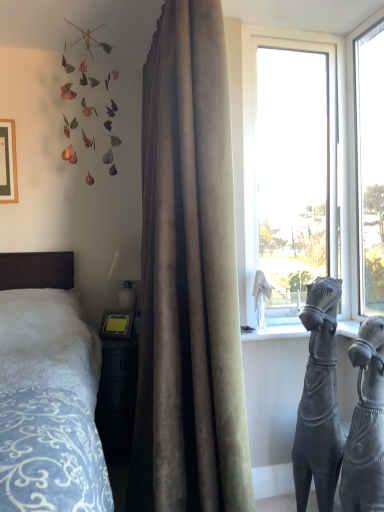
What do you see at coordinates (188, 278) in the screenshot? I see `satin curtain at center` at bounding box center [188, 278].

The height and width of the screenshot is (512, 384). In order to click on gray stone horse at right, which is the first sculpture in bottom-to-top order in this screenshot , I will do `click(366, 424)`.

Describe the element at coordinates (329, 144) in the screenshot. I see `transparent glass window at center, which appears as the 1th window when viewed from the left` at that location.

The width and height of the screenshot is (384, 512). In order to click on transparent glass sculpture at window, the 2th sculpture positioned from the front in this screenshot , I will do `click(261, 298)`.

Considering the sizes of objects transparent glass window at center, positioned as the second window in right-to-left order, and transparent glass window at upper right, the 2th window from the left, in the image provided, who is bigger, transparent glass window at center, positioned as the second window in right-to-left order, or transparent glass window at upper right, the 2th window from the left,?

Bigger between the two is transparent glass window at center, positioned as the second window in right-to-left order.

Considering the positions of points (244, 222) and (377, 147), is point (244, 222) closer to camera compared to point (377, 147)?

Yes, it is.

Where is `window below the transparent glass window at upper right, the 2th window from the left (from the image's perspective)`? The width and height of the screenshot is (384, 512). window below the transparent glass window at upper right, the 2th window from the left (from the image's perspective) is located at coordinates (329, 144).

Can you confirm if metallic leaf mobile at upper left is wider than transparent glass window at center, which appears as the 1th window when viewed from the left?

Yes.

Considering the relative sizes of metallic leaf mobile at upper left and transparent glass window at center, which appears as the 1th window when viewed from the left, in the image provided, is metallic leaf mobile at upper left smaller than transparent glass window at center, which appears as the 1th window when viewed from the left,?

No.

Can you tell me how much metallic leaf mobile at upper left and transparent glass window at center, positioned as the second window in right-to-left order, differ in facing direction?

The angular difference between metallic leaf mobile at upper left and transparent glass window at center, positioned as the second window in right-to-left order, is 0.187 degrees.

Which point is more forward, (63, 153) or (345, 265)?

The point (345, 265) is in front.

Considering the relative sizes of matte black picture frame at upper left and gray stone horse at right, which is the 2th sculpture in back-to-front order, in the image provided, is matte black picture frame at upper left shorter than gray stone horse at right, which is the 2th sculpture in back-to-front order,?

Correct, matte black picture frame at upper left is not as tall as gray stone horse at right, which is the 2th sculpture in back-to-front order.

Considering the points (12, 147) and (367, 440), which point is behind, point (12, 147) or point (367, 440)?

The point (12, 147) is farther.

Is there a large distance between matte black picture frame at upper left and gray stone horse at right, which is the 2th sculpture in back-to-front order?

Yes, matte black picture frame at upper left and gray stone horse at right, which is the 2th sculpture in back-to-front order, are quite far apart.

From the image's perspective, is matte black picture frame at upper left above gray stone horse at right, acting as the 1th sculpture starting from the right?

Indeed, from the image's perspective, matte black picture frame at upper left is shown above gray stone horse at right, acting as the 1th sculpture starting from the right.

Which object is wider, transparent glass sculpture at window, positioned as the 1th sculpture in back-to-front order, or gray stone horse at right, acting as the 1th sculpture starting from the right?

Wider between the two is gray stone horse at right, acting as the 1th sculpture starting from the right.

Does point (258, 314) come behind point (374, 432)?

Yes, it is behind point (374, 432).

Is transparent glass sculpture at window, which appears as the second sculpture when viewed from the right, positioned behind gray stone horse at right, acting as the 1th sculpture starting from the right?

Yes, it is behind gray stone horse at right, acting as the 1th sculpture starting from the right.

Is transparent glass sculpture at window, which appears as the 1th sculpture when viewed from the left, at the right side of gray stone horse at right, the second sculpture in the top-to-bottom sequence?

In fact, transparent glass sculpture at window, which appears as the 1th sculpture when viewed from the left, is to the left of gray stone horse at right, the second sculpture in the top-to-bottom sequence.

Who is taller, transparent glass window at center, which appears as the 1th window when viewed from the left, or white glossy table lamp at upper center?

transparent glass window at center, which appears as the 1th window when viewed from the left.

The width and height of the screenshot is (384, 512). In order to click on table lamp below the transparent glass window at center, positioned as the second window in right-to-left order (from a real-world perspective) in this screenshot , I will do `click(126, 276)`.

From the image's perspective, is transparent glass window at center, positioned as the second window in right-to-left order, above or below white glossy table lamp at upper center?

transparent glass window at center, positioned as the second window in right-to-left order, is situated higher than white glossy table lamp at upper center in the image.

Can you tell me how much transparent glass window at center, positioned as the second window in right-to-left order, and white glossy table lamp at upper center differ in facing direction?

1.27 degrees.

How far apart are satin curtain at center and bronze statue at right?

satin curtain at center is 57.76 centimeters away from bronze statue at right.

Does satin curtain at center turn towards bronze statue at right?

No, satin curtain at center is not facing towards bronze statue at right.

From the picture: From a real-world perspective, relative to bronze statue at right, is satin curtain at center vertically above or below?

satin curtain at center is situated higher than bronze statue at right in the real world.

Can you tell me how much satin curtain at center and bronze statue at right differ in facing direction?

They differ by 19.9 degrees in their facing directions.

From the metallic leaf mobile at upper left, count 2nd windows forward and point to it. Please provide its 2D coordinates.

[(370, 167)]

Looking at this image, are metallic leaf mobile at upper left and transparent glass window at upper right, which is the 1th window from right to left, making contact?

metallic leaf mobile at upper left is not next to transparent glass window at upper right, which is the 1th window from right to left, and they're not touching.

Considering the sizes of metallic leaf mobile at upper left and transparent glass window at upper right, which is the 1th window from right to left, in the image, is metallic leaf mobile at upper left taller or shorter than transparent glass window at upper right, which is the 1th window from right to left,?

Considering their sizes, metallic leaf mobile at upper left has less height than transparent glass window at upper right, which is the 1th window from right to left.

Which is in front, metallic leaf mobile at upper left or transparent glass window at upper right, which is the 1th window from right to left?

transparent glass window at upper right, which is the 1th window from right to left, is closer to the camera.

Image resolution: width=384 pixels, height=512 pixels. Identify the location of window located on the right of transparent glass window at center, which appears as the 1th window when viewed from the left. (370, 167).

In order to click on art on the left of transparent glass window at center, which appears as the 1th window when viewed from the left in this screenshot , I will do `click(84, 45)`.

Estimate the real-world distances between objects in this image. Which object is further from metallic leaf mobile at upper left, gray stone horse at right, acting as the 1th sculpture starting from the right, or bronze statue at right?

gray stone horse at right, acting as the 1th sculpture starting from the right, is further to metallic leaf mobile at upper left.

Based on their spatial positions, is transparent glass window at center, positioned as the second window in right-to-left order, or bronze statue at right further from transparent glass sculpture at window, which appears as the second sculpture when viewed from the right?

Among the two, transparent glass window at center, positioned as the second window in right-to-left order, is located further to transparent glass sculpture at window, which appears as the second sculpture when viewed from the right.

When comparing their distances from gray stone horse at right, placed as the 2th sculpture when sorted from left to right, does bronze statue at right or transparent glass window at center, which appears as the 1th window when viewed from the left, seem further?

transparent glass window at center, which appears as the 1th window when viewed from the left, lies further to gray stone horse at right, placed as the 2th sculpture when sorted from left to right, than the other object.

Based on their spatial positions, is metallic leaf mobile at upper left or white glossy table lamp at upper center closer to bronze statue at right?

white glossy table lamp at upper center lies closer to bronze statue at right than the other object.

Estimate the real-world distances between objects in this image. Which object is closer to metallic leaf mobile at upper left, transparent glass window at center, which appears as the 1th window when viewed from the left, or bronze statue at right?

Among the two, transparent glass window at center, which appears as the 1th window when viewed from the left, is located nearer to metallic leaf mobile at upper left.

Looking at the image, which one is located further to bronze statue at right, transparent glass window at upper right, the 2th window from the left, or satin curtain at center?

Based on the image, transparent glass window at upper right, the 2th window from the left, appears to be further to bronze statue at right.

When comparing their distances from transparent glass sculpture at window, which appears as the 1th sculpture when viewed from the left, does bronze statue at right or gray stone horse at right, placed as the 2th sculpture when sorted from left to right, seem closer?

bronze statue at right.

Estimate the real-world distances between objects in this image. Which object is closer to metallic leaf mobile at upper left, satin curtain at center or transparent glass sculpture at window, the 2th sculpture in the bottom-to-top sequence?

The object closer to metallic leaf mobile at upper left is satin curtain at center.

Find the location of a particular element. table lamp between metallic leaf mobile at upper left and bronze statue at right from top to bottom is located at coordinates (126, 276).

In order to click on sculpture between metallic leaf mobile at upper left and white glossy table lamp at upper center in the up-down direction in this screenshot , I will do `click(261, 298)`.

Where is `art situated between matte black picture frame at upper left and gray stone horse at right, placed as the 2th sculpture when sorted from left to right, from left to right`? This screenshot has width=384, height=512. art situated between matte black picture frame at upper left and gray stone horse at right, placed as the 2th sculpture when sorted from left to right, from left to right is located at coordinates (84, 45).

Locate an element on the screen. table lamp between metallic leaf mobile at upper left and gray stone horse at right, placed as the first sculpture when sorted from front to back, from top to bottom is located at coordinates [x=126, y=276].